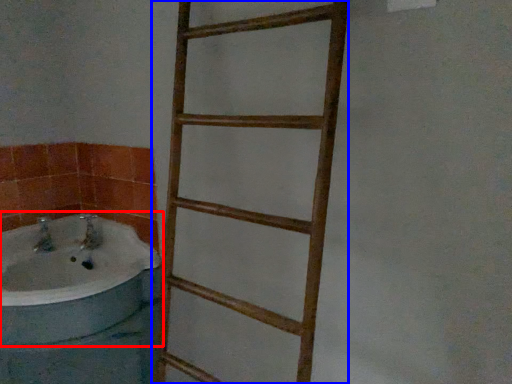
Question: Which of the following is the closest to the observer, bathtub (highlighted by a red box) or ladder (highlighted by a blue box)?

Choices:
 (A) bathtub
 (B) ladder

Answer: (B)